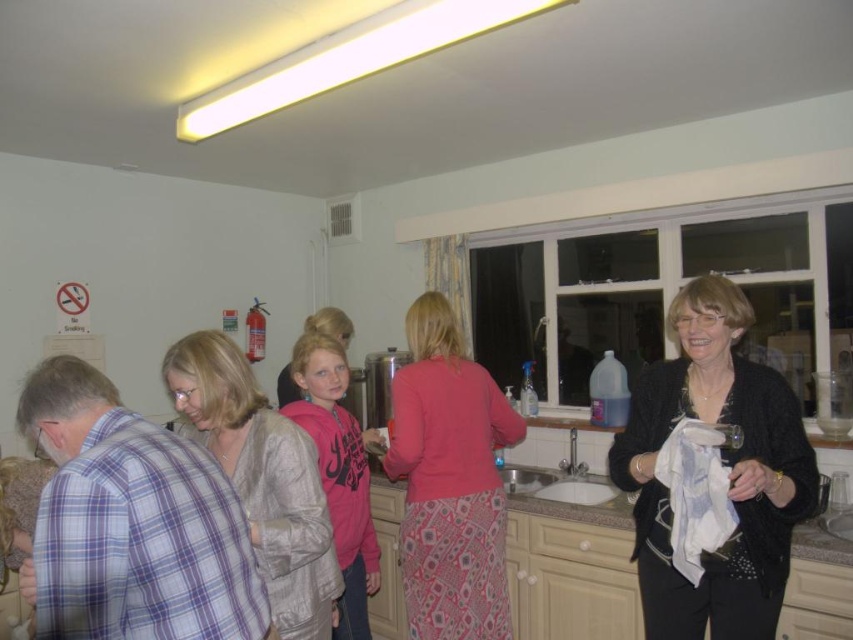
You are organizing a clothing donation drive and need to determine if the black knitwear at right can be folded and placed on top of the pink fabric skirt at center without damaging either item. Based on their positions in the image, can you confirm if this is feasible?

The black knitwear at right is already positioned over the pink fabric skirt at center, indicating that it can be folded and placed on top without causing damage to either item.

Looking at this image, you are standing in the kitchen area and notice the black knitwear at right. Can you determine its exact position using the coordinate system provided?

The black knitwear at right is located at point [724,465].